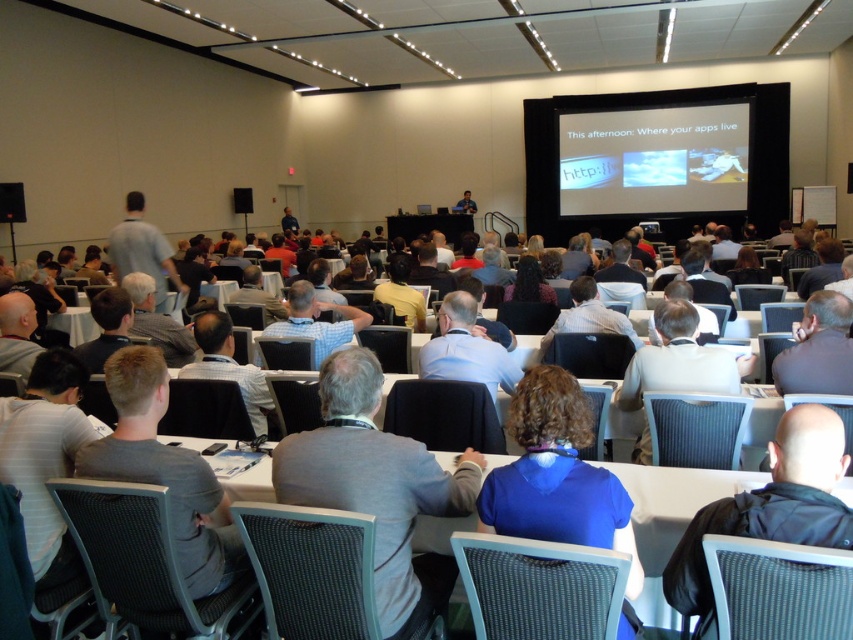
You are standing in the conference room and want to reach the point marked at coordinates (279,480). The tables in the room are 1.8 meters wide. Can you walk through the space between the tables to reach that point?

The point marked at coordinates (279,480) is 1.95 meters away from the viewer. Since the tables are 1.8 meters wide, you can walk through the space between the tables to reach that point as the distance is sufficient.

You are standing at the entrance of the conference room and want to locate the gray fabric shirt at center. According to the coordinates provided, in which direction should you look to find it?

The gray fabric shirt at center is located at coordinates point (376,486), so you should look towards the lower right direction from your position at the entrance.

You are an event organizer who wants to seat two speakers at the front of the conference room. The gray fabric shirt at center and the blue matte shirt at center are the two speakers. The podium is located at the very front of the room. Which speaker should be seated closer to the podium to ensure visibility for the audience?

The gray fabric shirt at center should be seated closer to the podium because it is bigger than the blue matte shirt at center, making it more visible to the audience.